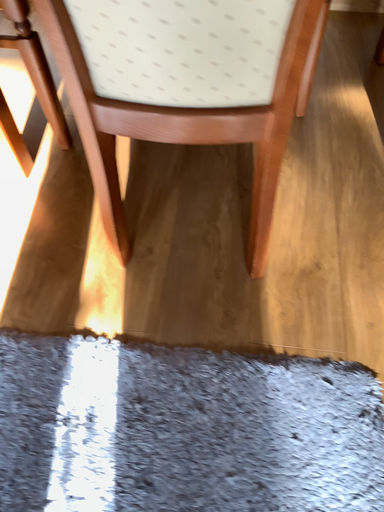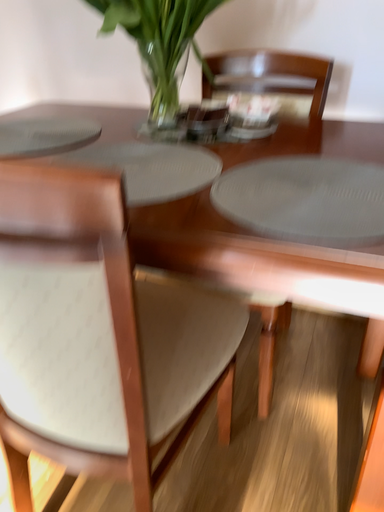
Question: Which way did the camera rotate in the video?

Choices:
 (A) rotated right
 (B) rotated left

Answer: (B)